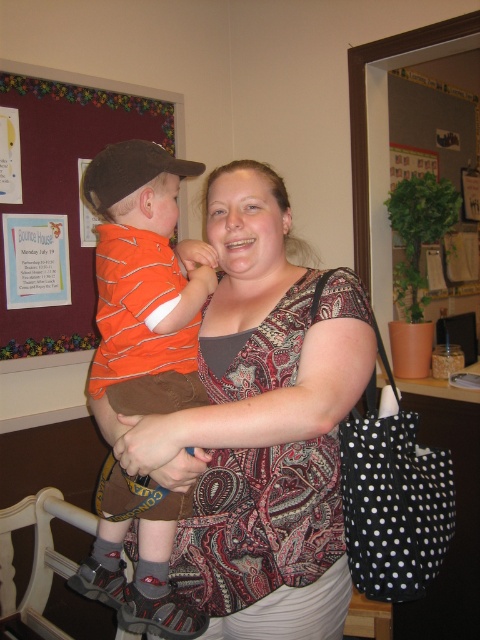
Who is more distant from viewer, (110, 129) or (216, 328)?

Positioned behind is point (110, 129).

Is the position of orange striped shirt at upper left less distant than that of matte brown arm at center?

No, orange striped shirt at upper left is further to the viewer.

Measure the distance between point (82, 253) and camera.

Point (82, 253) is 7.23 feet away from camera.

In order to click on orange striped shirt at upper left in this screenshot , I will do `click(67, 192)`.

Does orange striped shirt at upper left appear over wooden rocking chair at lower left?

Yes.

Can you confirm if orange striped shirt at upper left is bigger than wooden rocking chair at lower left?

Indeed, orange striped shirt at upper left has a larger size compared to wooden rocking chair at lower left.

Measure the distance between orange striped shirt at upper left and camera.

orange striped shirt at upper left and camera are 2.00 meters apart from each other.

Identify the location of orange striped shirt at upper left. (67, 192).

Is paisley-patterned blouse at center in front of orange striped shirt at upper left?

Yes, paisley-patterned blouse at center is in front of orange striped shirt at upper left.

Can you confirm if paisley-patterned blouse at center is positioned below orange striped shirt at upper left?

Indeed, paisley-patterned blouse at center is positioned under orange striped shirt at upper left.

Measure the distance between paisley-patterned blouse at center and camera.

paisley-patterned blouse at center is 37.01 inches away from camera.

You are a GUI agent. You are given a task and a screenshot of the screen. Output one action in this format:
    pyautogui.click(x=<x>, y=<y>)
    Task: Click on the paisley-patterned blouse at center
    The height and width of the screenshot is (640, 480).
    Given the screenshot: What is the action you would take?
    pyautogui.click(x=264, y=424)